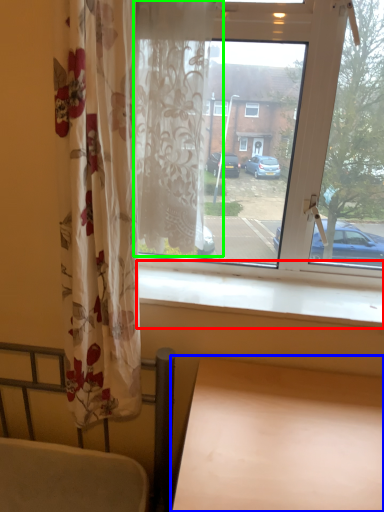
Question: Which object is the farthest from window sill (highlighted by a red box)? Choose among these: table (highlighted by a blue box) or curtain (highlighted by a green box).

Choices:
 (A) table
 (B) curtain

Answer: (B)